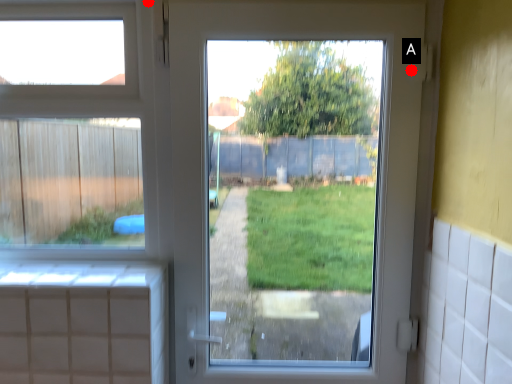
Question: Two points are circled on the image, labeled by A and B beside each circle. Which point appears farthest from the camera in this image?

Choices:
 (A) A is further
 (B) B is further

Answer: (B)